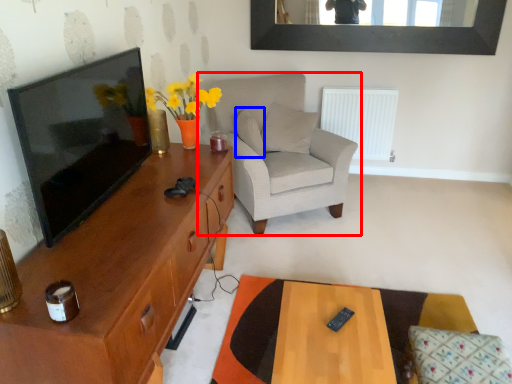
Question: Which point is closer to the camera, chair (highlighted by a red box) or pillow (highlighted by a blue box)?

Choices:
 (A) chair
 (B) pillow

Answer: (A)